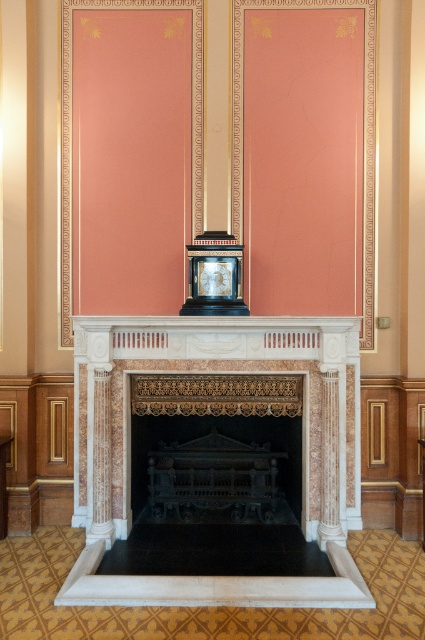
You are an interior designer planning to place a new decorative item on the mantelpiece. The marble fireplace at center currently holds the matte black clock at center. Considering their sizes, which object would you need to adjust if you want to add a larger ornament without removing either existing item?

The marble fireplace at center has a larger size compared to the matte black clock at center. To add a larger ornament without removing either item, you would need to adjust the position of the matte black clock at center to make space on the mantelpiece.

You are standing in the living room and want to place a small vase on the closest object to you between the black marble fireplace at center and the matte black clock at center. Which object should you choose?

The black marble fireplace at center is closer to you than the matte black clock at center, so you should place the vase on the black marble fireplace at center.